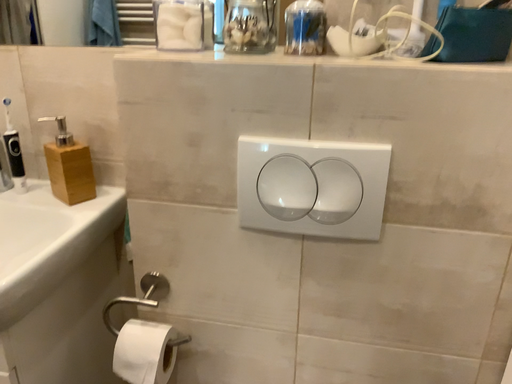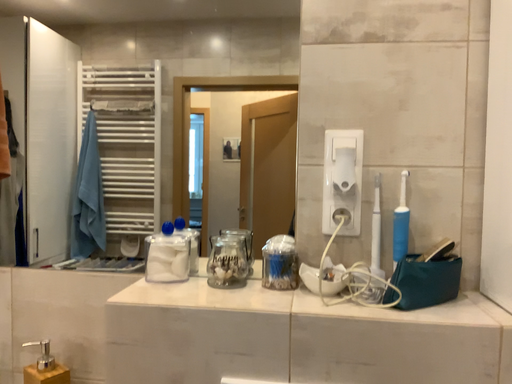
Question: How did the camera likely rotate when shooting the video?

Choices:
 (A) rotated downward
 (B) rotated upward

Answer: (B)